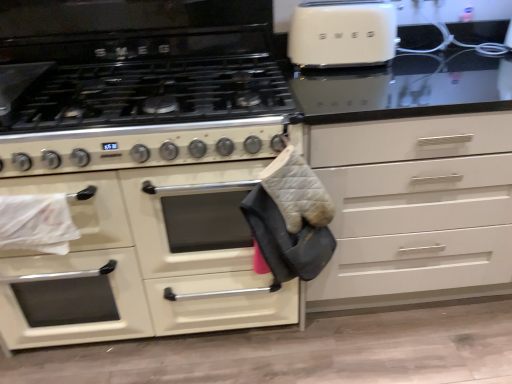
Question: Can you confirm if white matte drawer at center is thinner than gray quilted oven mitt at center?

Choices:
 (A) no
 (B) yes

Answer: (A)

Question: Considering the relative positions of white matte drawer at center and gray quilted oven mitt at center in the image provided, is white matte drawer at center to the right of gray quilted oven mitt at center from the viewer's perspective?

Choices:
 (A) no
 (B) yes

Answer: (B)

Question: Could you tell me if white matte drawer at center is facing gray quilted oven mitt at center?

Choices:
 (A) no
 (B) yes

Answer: (A)

Question: Is white matte drawer at center next to gray quilted oven mitt at center and touching it?

Choices:
 (A) no
 (B) yes

Answer: (A)

Question: Would you consider white matte drawer at center to be distant from gray quilted oven mitt at center?

Choices:
 (A) yes
 (B) no

Answer: (B)

Question: From the image's perspective, is matte white oven at center located above or below white matte drawer at center?

Choices:
 (A) below
 (B) above

Answer: (A)

Question: Is matte white oven at center situated inside white matte drawer at center or outside?

Choices:
 (A) inside
 (B) outside

Answer: (B)

Question: From a real-world perspective, is matte white oven at center above or below white matte drawer at center?

Choices:
 (A) above
 (B) below

Answer: (B)

Question: Is matte white oven at center in front of or behind white matte drawer at center in the image?

Choices:
 (A) front
 (B) behind

Answer: (B)

Question: From the image's perspective, relative to matte white oven at center, is gray quilted oven mitt at center above or below?

Choices:
 (A) above
 (B) below

Answer: (A)

Question: Visually, is gray quilted oven mitt at center positioned to the left or to the right of matte white oven at center?

Choices:
 (A) left
 (B) right

Answer: (B)

Question: From a real-world perspective, is gray quilted oven mitt at center above or below matte white oven at center?

Choices:
 (A) below
 (B) above

Answer: (B)

Question: In terms of width, does gray quilted oven mitt at center look wider or thinner when compared to matte white oven at center?

Choices:
 (A) thin
 (B) wide

Answer: (A)

Question: From the image's perspective, is white matte drawer at center above or below gray quilted oven mitt at center?

Choices:
 (A) below
 (B) above

Answer: (B)

Question: Does point (501, 200) appear closer or farther from the camera than point (275, 203)?

Choices:
 (A) closer
 (B) farther

Answer: (B)